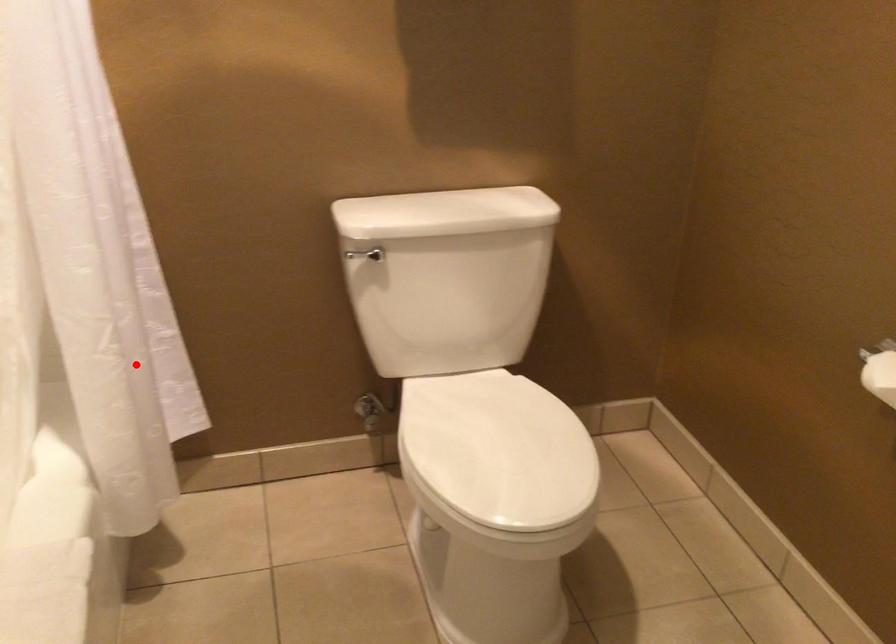
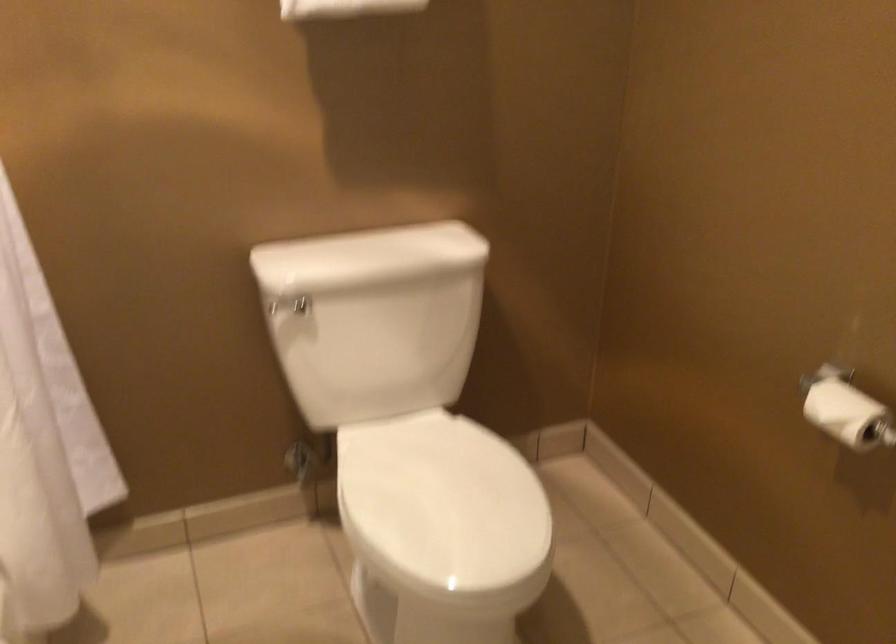
Find the pixel in the second image that matches the highlighted location in the first image.

(44, 444)